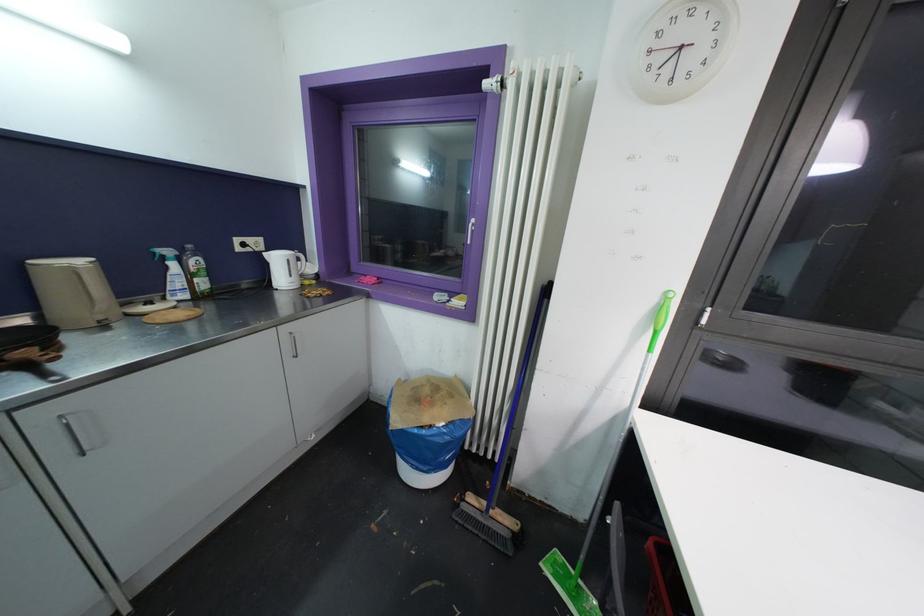
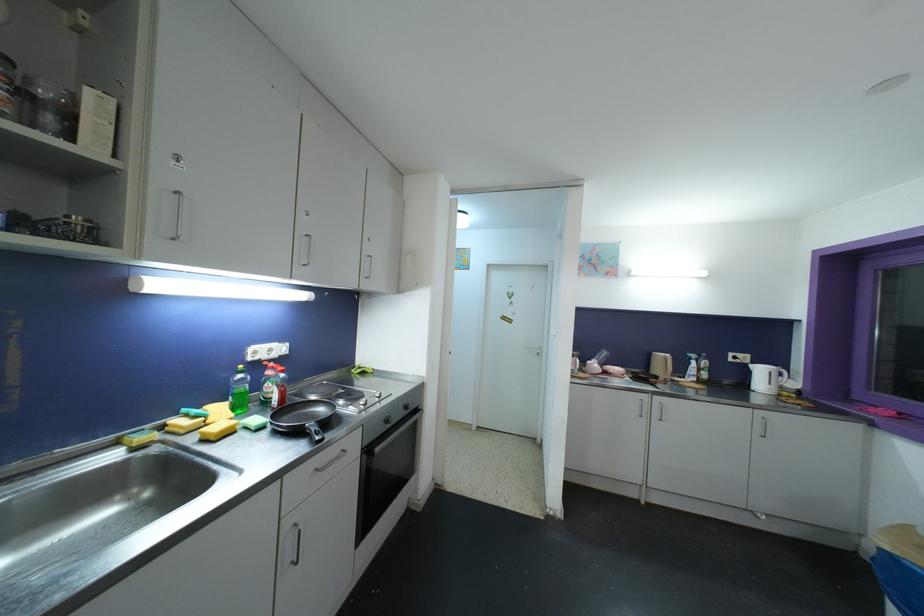
Where in the second image is the point corresponding to (239,243) from the first image?

(734, 357)